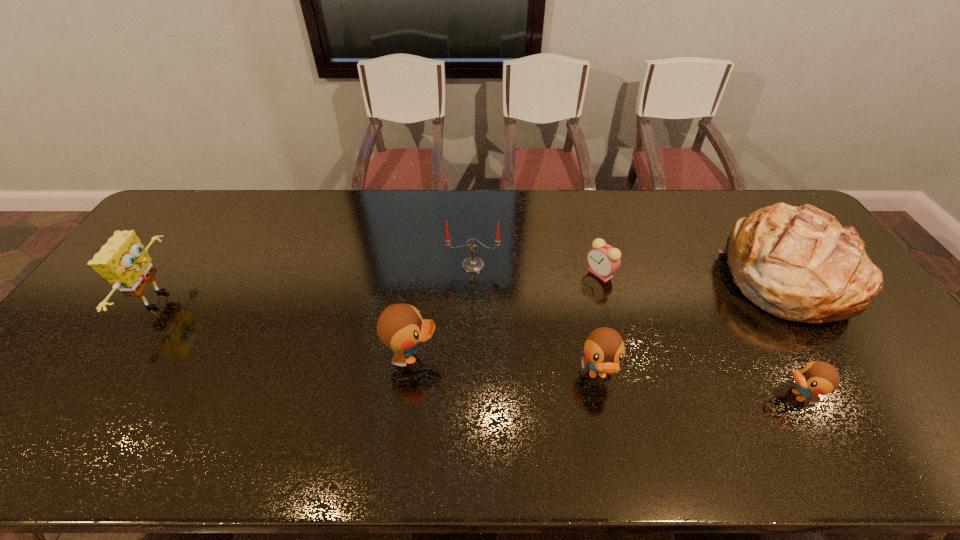
Find the location of a particular element. object present at the right edge is located at coordinates (798, 263).

This screenshot has width=960, height=540. I want to click on object located in the far right corner section of the desktop, so click(x=798, y=263).

At what (x,y) coordinates should I click in order to perform the action: click on free space at the far edge of the desktop. Please return your answer as a coordinate pair (x, y). The image size is (960, 540). Looking at the image, I should click on (716, 200).

Locate an element on the screen. vacant area at the near edge is located at coordinates (102, 408).

In the image, there is a desktop. In order to click on vacant region at the left edge in this screenshot , I will do `click(87, 377)`.

Find the location of a particular element. The width and height of the screenshot is (960, 540). empty space that is in between the candle and the alarm clock is located at coordinates (537, 269).

Where is `free point between the alarm clock and the rightmost duck`? The image size is (960, 540). free point between the alarm clock and the rightmost duck is located at coordinates (699, 334).

Identify the location of free space between the alarm clock and the leftmost object. This screenshot has width=960, height=540. (380, 286).

Locate an element on the screen. The image size is (960, 540). unoccupied area between the alarm clock and the tallest duck is located at coordinates (506, 315).

Image resolution: width=960 pixels, height=540 pixels. I want to click on empty space between the alarm clock and the leftmost duck, so click(506, 315).